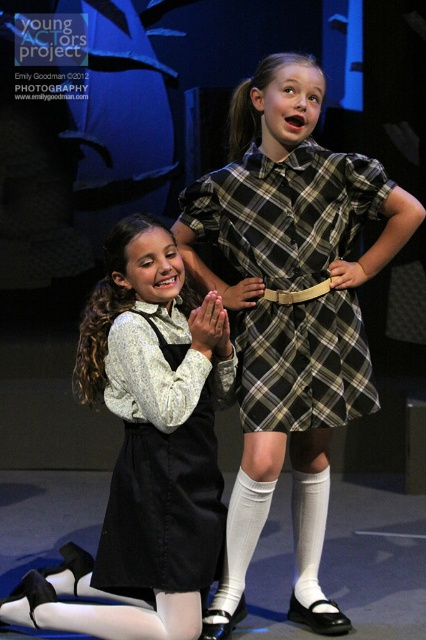
Question: Among these points, which one is farthest from the camera?

Choices:
 (A) (210, 554)
 (B) (184, 445)

Answer: (B)

Question: Which point is farther to the camera?

Choices:
 (A) plaid fabric dress at center
 (B) matte black dress at center
 (C) black cotton dress at lower left

Answer: (A)

Question: Does plaid fabric dress at center have a larger size compared to black cotton dress at lower left?

Choices:
 (A) yes
 (B) no

Answer: (A)

Question: Is plaid fabric dress at center to the right of black cotton dress at lower left from the viewer's perspective?

Choices:
 (A) yes
 (B) no

Answer: (A)

Question: Can you confirm if matte black dress at center is positioned to the right of black cotton dress at lower left?

Choices:
 (A) yes
 (B) no

Answer: (B)

Question: Which object appears closest to the camera in this image?

Choices:
 (A) black cotton dress at lower left
 (B) matte black dress at center

Answer: (A)